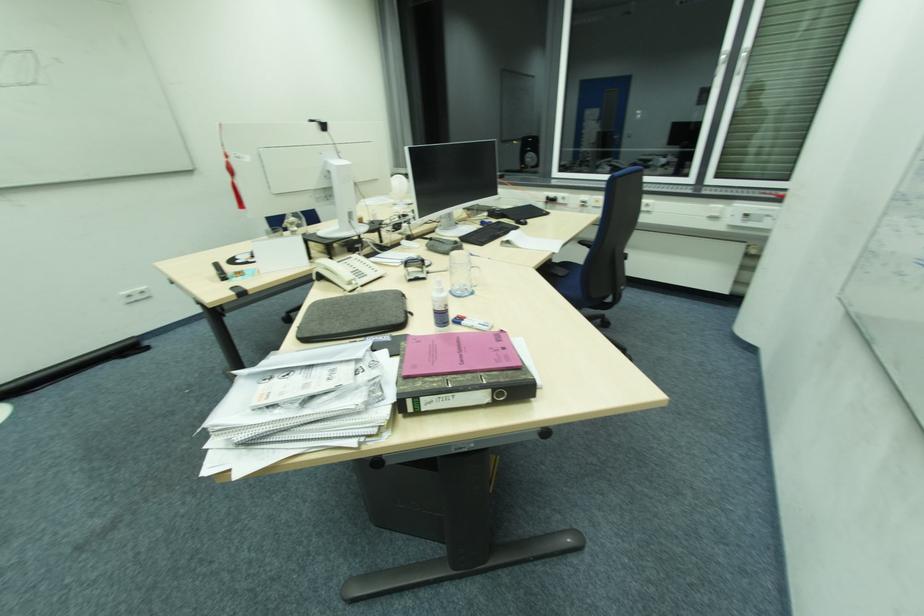
Describe the element at coordinates (458, 353) in the screenshot. I see `a pink ring binder` at that location.